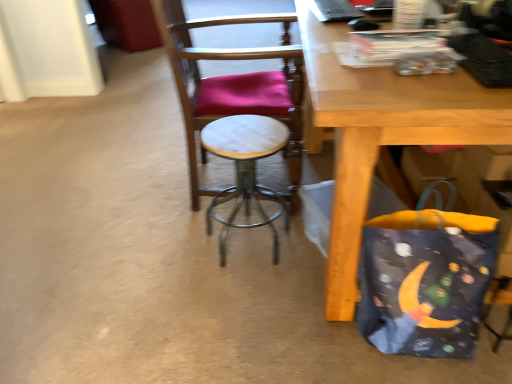
Locate an element on the screen. The image size is (512, 384). vacant area that is in front of marble seat at center is located at coordinates (205, 270).